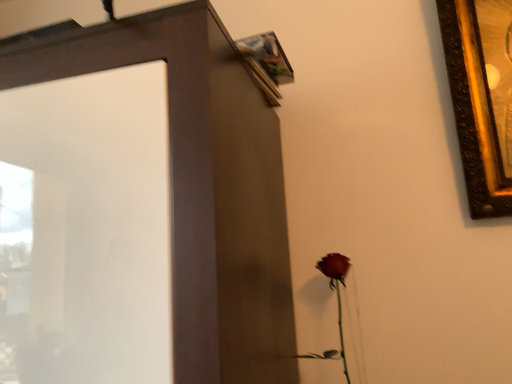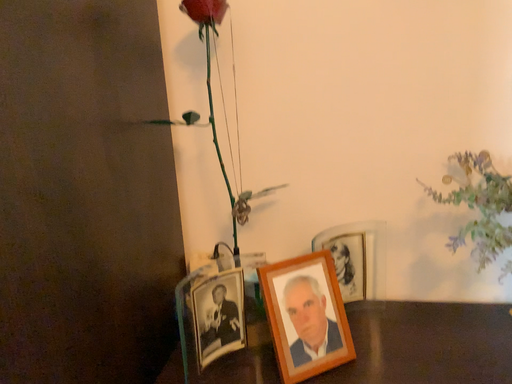
Question: How did the camera likely rotate when shooting the video?

Choices:
 (A) rotated downward
 (B) rotated upward

Answer: (A)